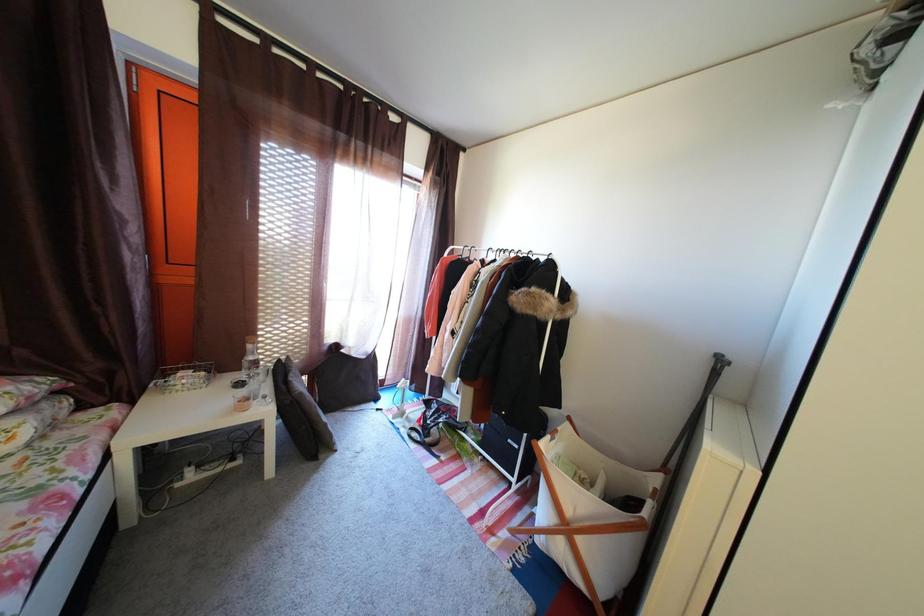
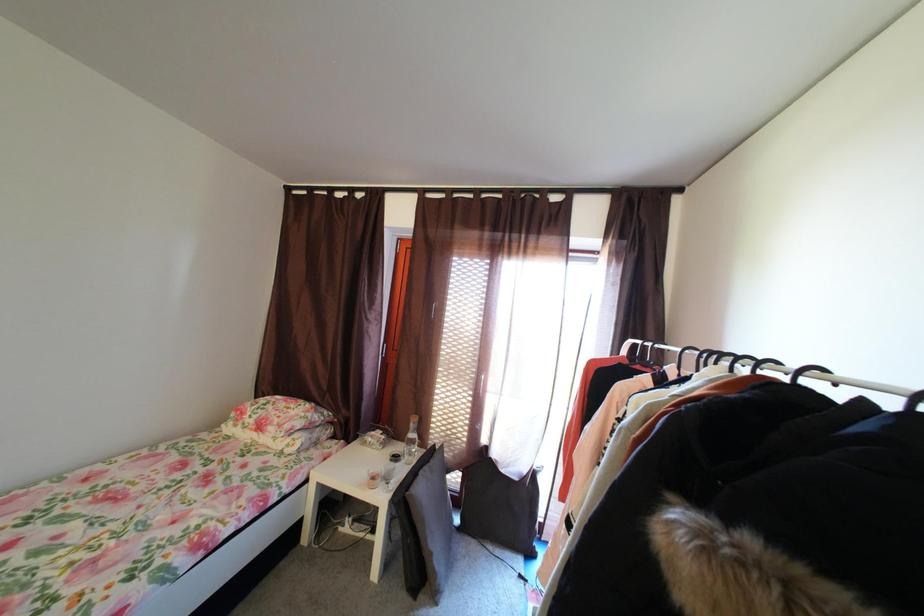
Question: The images are taken continuously from a first-person perspective. In which direction is your viewpoint rotating?

Choices:
 (A) Left
 (B) Right
 (C) Up
 (D) Down

Answer: (A)